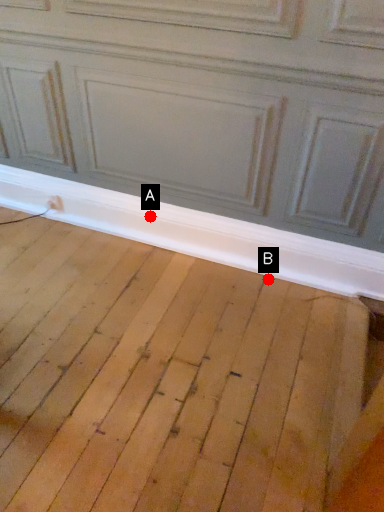
Question: Two points are circled on the image, labeled by A and B beside each circle. Which of the following is the farthest from the observer?

Choices:
 (A) A is further
 (B) B is further

Answer: (A)